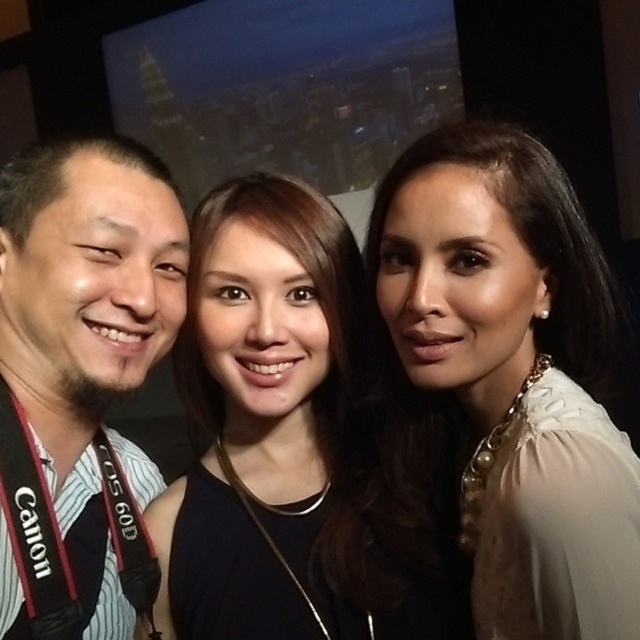
Does white pearl necklace at upper right have a greater height compared to matte black shirt at left?

Yes.

Is white pearl necklace at upper right smaller than matte black shirt at left?

No, white pearl necklace at upper right is not smaller than matte black shirt at left.

Is point (509, 545) positioned in front of point (170, 262)?

Yes, point (509, 545) is closer to viewer.

The width and height of the screenshot is (640, 640). In order to click on white pearl necklace at upper right in this screenshot , I will do `click(513, 376)`.

Consider the image. Does white pearl necklace at upper right have a greater height compared to black fabric dress at center?

Yes.

Is white pearl necklace at upper right below black fabric dress at center?

No.

Between point (525, 576) and point (225, 506), which one is positioned behind?

Positioned behind is point (225, 506).

At what (x,y) coordinates should I click in order to perform the action: click on white pearl necklace at upper right. Please return your answer as a coordinate pair (x, y). The width and height of the screenshot is (640, 640). Looking at the image, I should click on (513, 376).

Is black fabric dress at center bigger than matte black shirt at left?

Incorrect, black fabric dress at center is not larger than matte black shirt at left.

Does point (195, 515) lie behind point (19, 490)?

Yes, it is behind point (19, 490).

Locate an element on the screen. black fabric dress at center is located at coordinates (272, 422).